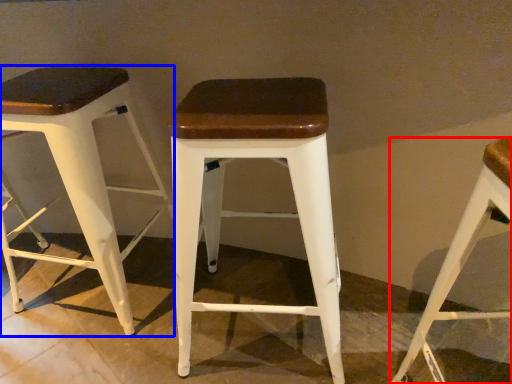
Question: Which of the following is the farthest to the observer, stool (highlighted by a red box) or stool (highlighted by a blue box)?

Choices:
 (A) stool
 (B) stool

Answer: (B)